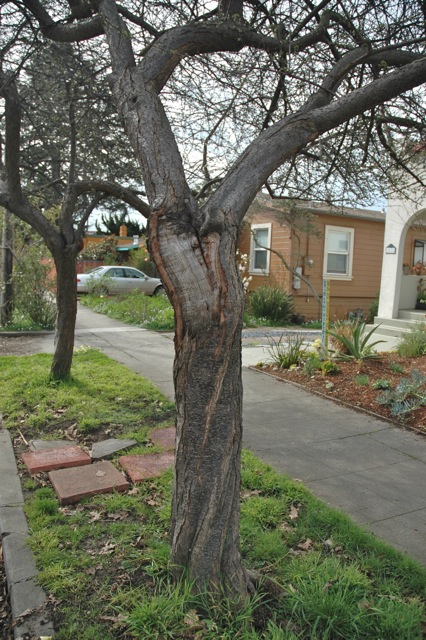
Image resolution: width=426 pixels, height=640 pixels. I want to click on chimney, so click(134, 239), click(122, 226).